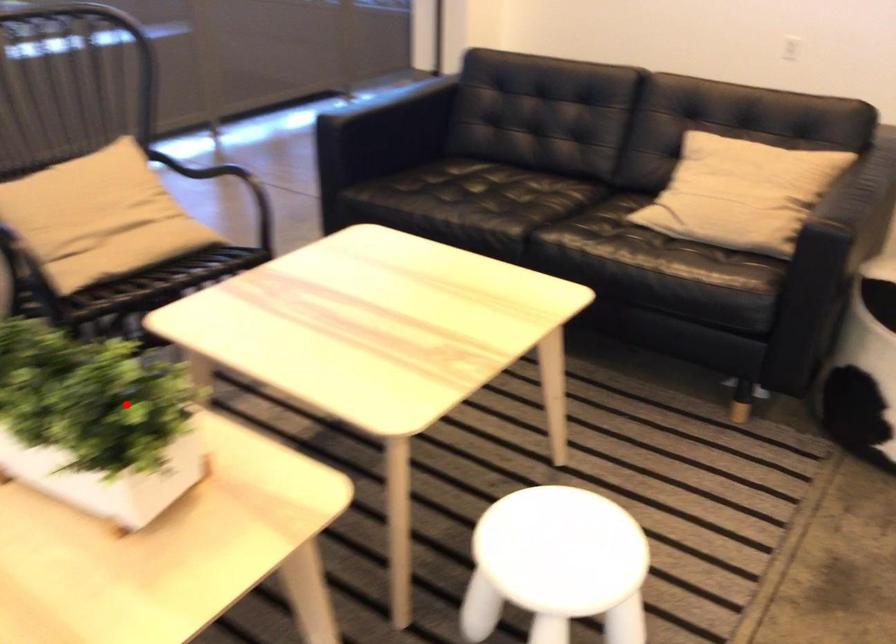
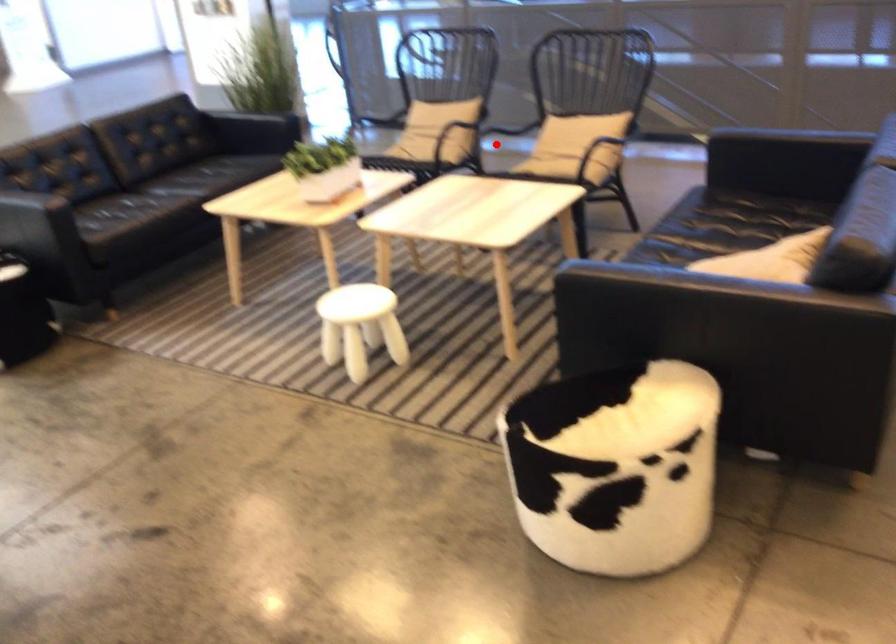
I am providing you with two images of the same scene from different viewpoints. A red point is marked on the first image and another point is marked on the second image. Is the marked point in image1 the same physical position as the marked point in image2?

No